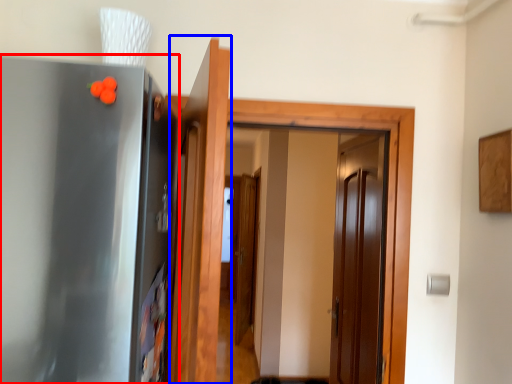
Question: Which of the following is the farthest to the observer, appliance (highlighted by a red box) or door (highlighted by a blue box)?

Choices:
 (A) appliance
 (B) door

Answer: (A)